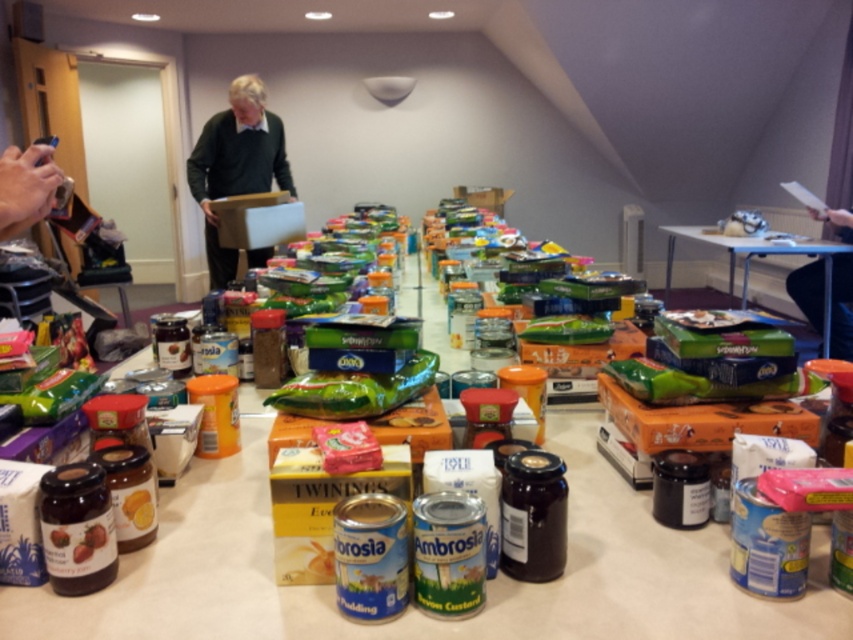
Question: Which point is closer to the camera?

Choices:
 (A) green plastic bag at center
 (B) green matte bag at center

Answer: (B)

Question: Does green sweater at center come in front of green matte bag at center?

Choices:
 (A) yes
 (B) no

Answer: (B)

Question: Does green sweater at center have a greater width compared to green matte bag at center?

Choices:
 (A) yes
 (B) no

Answer: (A)

Question: Which object is positioned farthest from the green sweater at center?

Choices:
 (A) green matte bag at center
 (B) green plastic bag at center

Answer: (B)

Question: Which of the following is the farthest from the observer?

Choices:
 (A) (846, 324)
 (B) (337, 416)

Answer: (A)

Question: Can you confirm if green sweater at center is thinner than green matte bag at center?

Choices:
 (A) no
 (B) yes

Answer: (A)